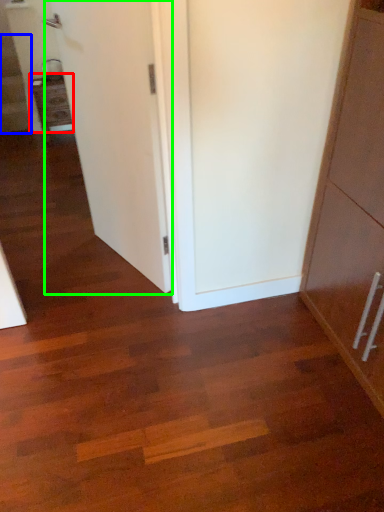
Question: Considering the real-world distances, which object is closest to cabinetry (highlighted by a red box)? stairwell (highlighted by a blue box) or door (highlighted by a green box).

Choices:
 (A) stairwell
 (B) door

Answer: (A)